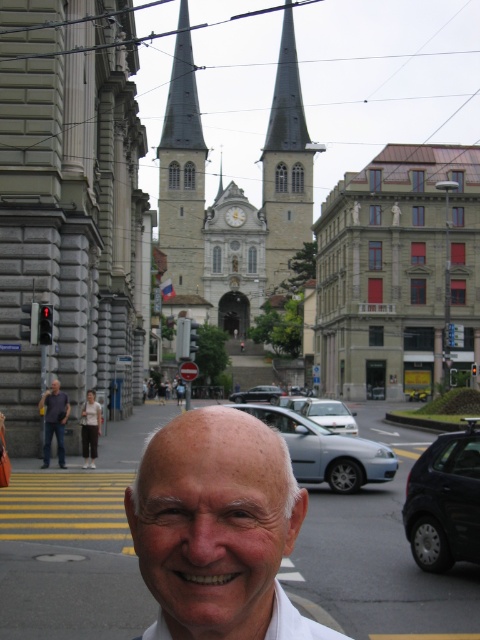
In the scene shown: Who is higher up, gray stone tower at center or black glossy car at lower right?

Positioned higher is gray stone tower at center.

Who is lower down, gray stone tower at center or black glossy car at lower right?

black glossy car at lower right

This screenshot has height=640, width=480. Identify the location of gray stone tower at center. (181, 170).

Does red brick building at center have a larger size compared to dark blue shirt at center?

Indeed, red brick building at center has a larger size compared to dark blue shirt at center.

Can you confirm if red brick building at center is positioned to the right of dark blue shirt at center?

Correct, you'll find red brick building at center to the right of dark blue shirt at center.

Who is more distant from viewer, (336, 275) or (60, 413)?

Positioned behind is point (336, 275).

Locate an element on the screen. This screenshot has height=640, width=480. red brick building at center is located at coordinates (397, 273).

Who is lower down, red brick building at center or white cotton shirt at center?

Positioned lower is white cotton shirt at center.

Is red brick building at center further to camera compared to white cotton shirt at center?

Yes, red brick building at center is further from the viewer.

At what (x,y) coordinates should I click in order to perform the action: click on red brick building at center. Please return your answer as a coordinate pair (x, y). The width and height of the screenshot is (480, 640). Looking at the image, I should click on (397, 273).